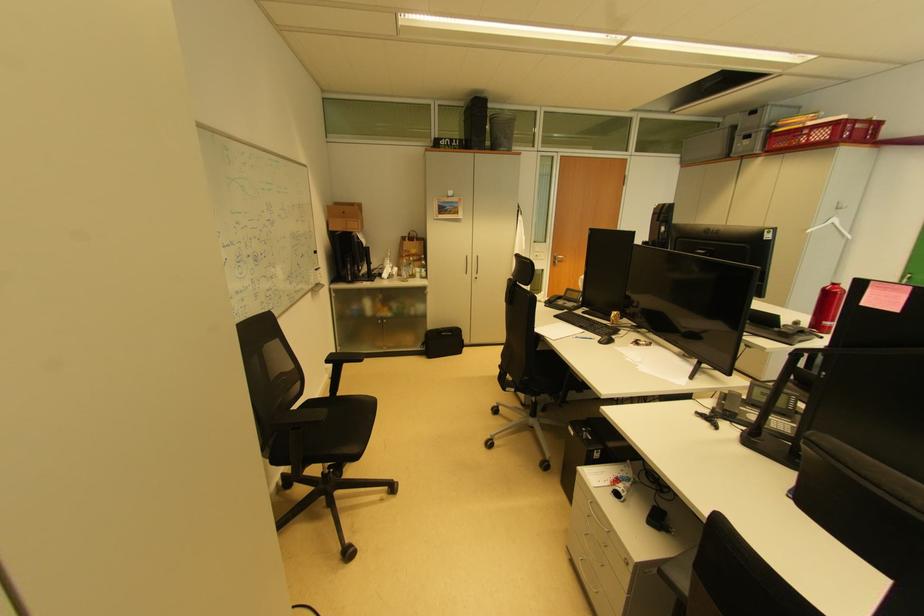
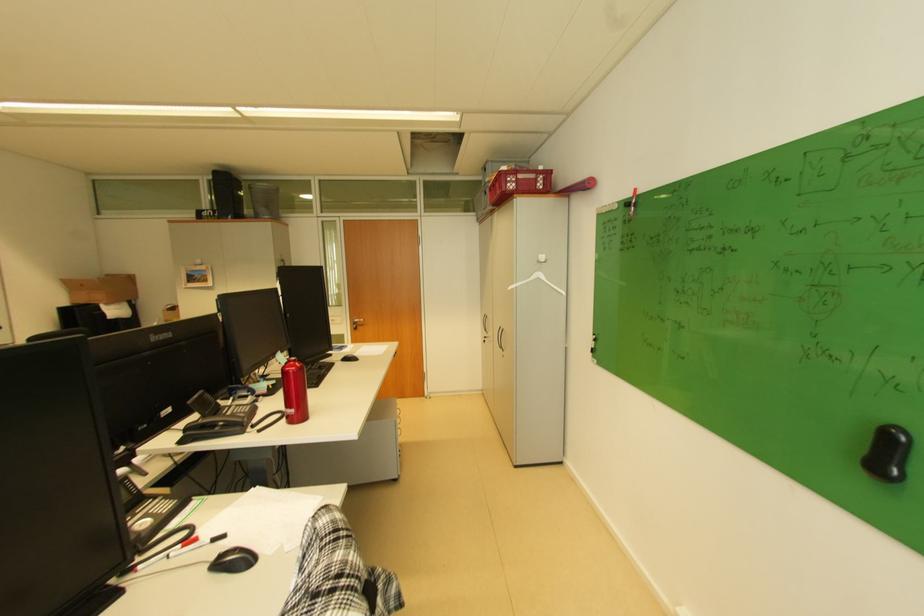
Find the pixel in the second image that matches pixel 867 127 in the first image.

(529, 177)